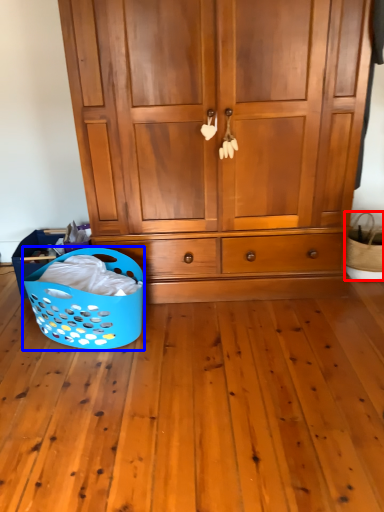
Question: Which object appears farthest to the camera in this image, basket (highlighted by a red box) or basket (highlighted by a blue box)?

Choices:
 (A) basket
 (B) basket

Answer: (A)